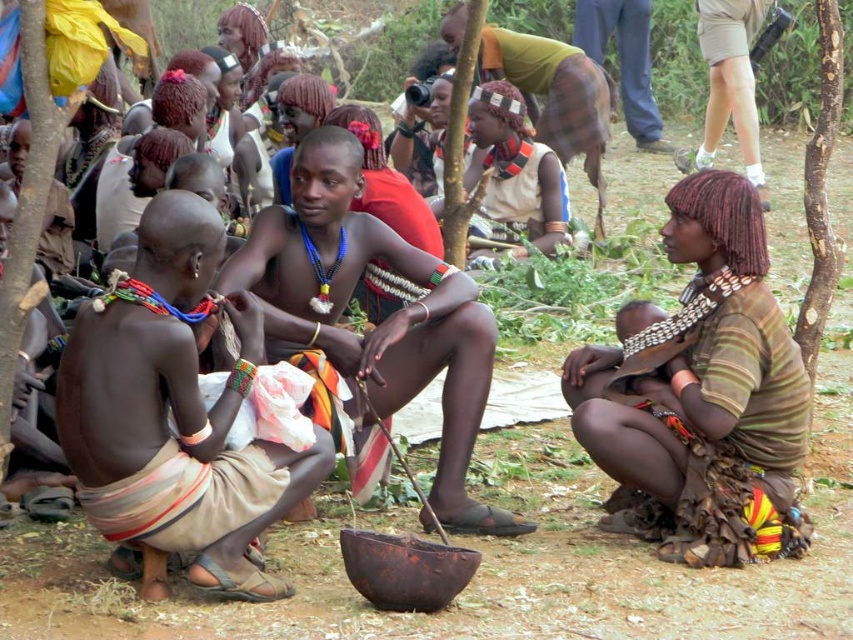
You are a photographer trying to capture a group photo of the matte brown shirt at center and the khaki shorts at upper right. Based on their sizes, which one should you focus on to ensure they are both in frame without cropping? Explain your reasoning.

The matte brown shirt at center is wider than the khaki shorts at upper right, so focusing on the matte brown shirt at center ensures both will fit in the frame without cropping since it occupies more space.

Consider the image. You are standing in the scene and want to move from point A to point B. Point A is at coordinate point [700,328] and point B is at coordinate point [154,243]. Since you can only move forward, will you be able to reach point B without turning around?

Point [700,328] is further to the viewer than point [154,243]. Therefore, moving forward from point A to point B is not possible without turning around because point B is behind you relative to your starting position.